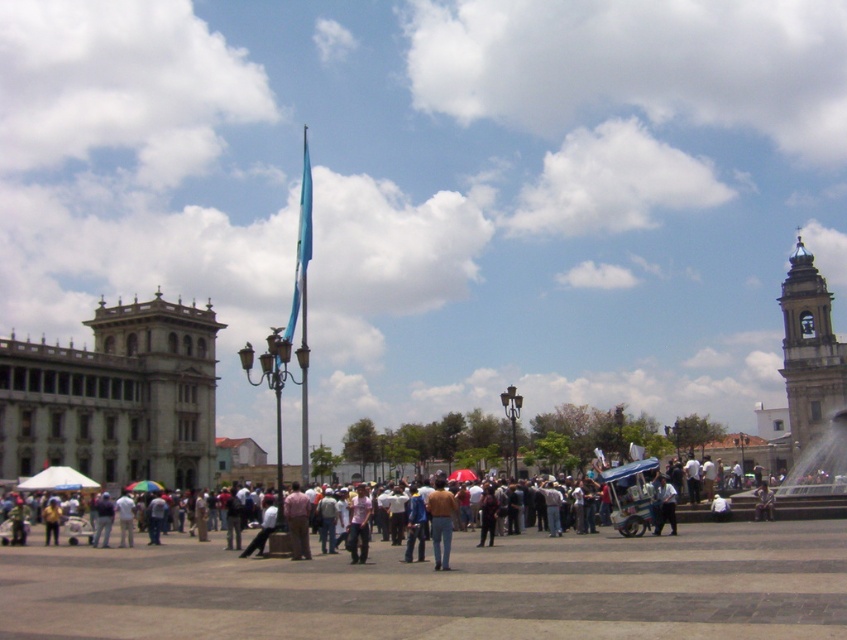
Can you confirm if metallic fountain at right is bigger than blue fabric flag pole at center?

No, metallic fountain at right is not bigger than blue fabric flag pole at center.

Which is more to the right, metallic fountain at right or blue fabric flag pole at center?

metallic fountain at right

Image resolution: width=847 pixels, height=640 pixels. Identify the location of metallic fountain at right. (817, 476).

Locate an element on the screen. metallic fountain at right is located at coordinates (817, 476).

Does metallic fountain at right appear under pink fabric shirt at center?

No, metallic fountain at right is not below pink fabric shirt at center.

Who is lower down, metallic fountain at right or pink fabric shirt at center?

Positioned lower is pink fabric shirt at center.

Is point (815, 470) more distant than point (289, 508)?

Yes, it is behind point (289, 508).

In order to click on metallic fountain at right in this screenshot , I will do `click(817, 476)`.

Image resolution: width=847 pixels, height=640 pixels. What are the coordinates of `gold metallic bell tower at right` in the screenshot? It's located at [x=809, y=349].

Who is shorter, gold metallic bell tower at right or brown leather jacket at center?

brown leather jacket at center

Is point (809, 384) positioned after point (436, 509)?

Yes, it is.

You are a GUI agent. You are given a task and a screenshot of the screen. Output one action in this format:
    pyautogui.click(x=<x>, y=<y>)
    Task: Click on the gold metallic bell tower at right
    
    Given the screenshot: What is the action you would take?
    pyautogui.click(x=809, y=349)